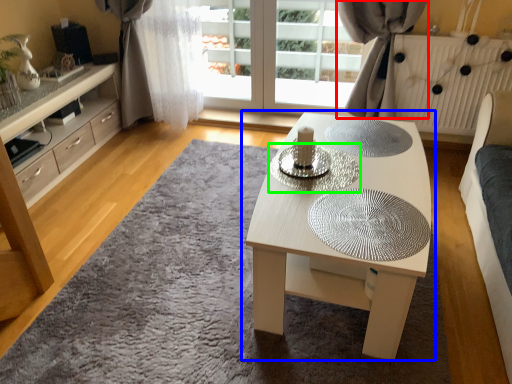
Question: Which object is positioned farthest from curtain (highlighted by a red box)? Select from coffee table (highlighted by a blue box) and glass plate (highlighted by a green box).

Choices:
 (A) coffee table
 (B) glass plate

Answer: (B)